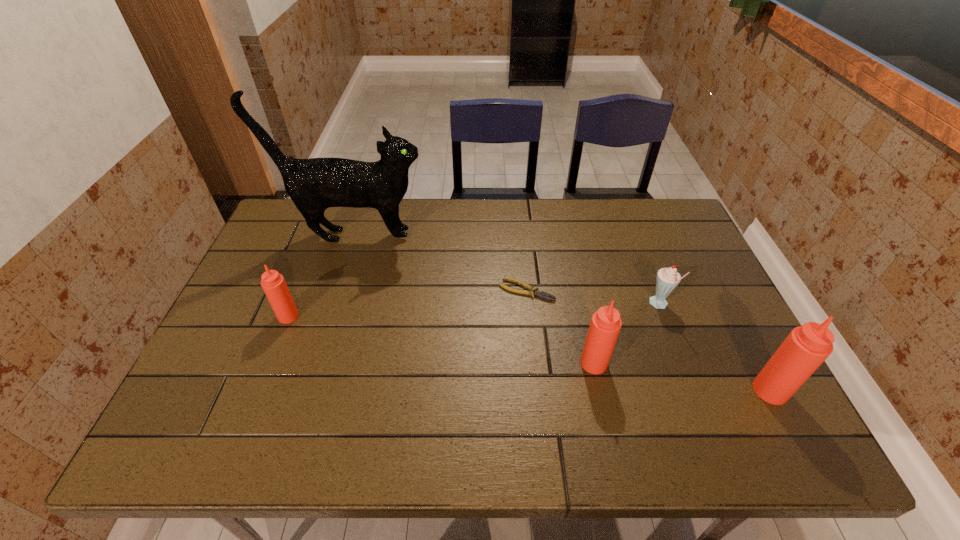
The height and width of the screenshot is (540, 960). Find the location of `free region at the left edge of the desktop`. free region at the left edge of the desktop is located at coordinates (265, 272).

In the image, there is a desktop. Identify the location of vacant space at the right edge. This screenshot has width=960, height=540. (697, 350).

Find the location of a particular element. The width and height of the screenshot is (960, 540). free space at the far left corner is located at coordinates (304, 220).

The image size is (960, 540). I want to click on free space at the far right corner, so click(678, 231).

This screenshot has width=960, height=540. In order to click on vacant space that's between the farthest Tabasco sauce and the cat in this screenshot , I will do `click(322, 276)`.

This screenshot has height=540, width=960. In order to click on free spot between the cat and the nearest Tabasco sauce in this screenshot , I will do `click(563, 313)`.

The image size is (960, 540). Identify the location of vacant space that's between the second tallest Tabasco sauce and the cat. (474, 300).

At what (x,y) coordinates should I click in order to perform the action: click on free space between the second tallest Tabasco sauce and the farthest Tabasco sauce. Please return your answer as a coordinate pair (x, y). Looking at the image, I should click on (442, 340).

At what (x,y) coordinates should I click in order to perform the action: click on vacant point located between the third object from left to right and the second farthest Tabasco sauce. Please return your answer as a coordinate pair (x, y). This screenshot has width=960, height=540. Looking at the image, I should click on (561, 327).

You are a GUI agent. You are given a task and a screenshot of the screen. Output one action in this format:
    pyautogui.click(x=<x>, y=<y>)
    Task: Click on the unoccupied position between the second shortest object and the shortest object
    The width and height of the screenshot is (960, 540).
    Given the screenshot: What is the action you would take?
    pyautogui.click(x=593, y=298)